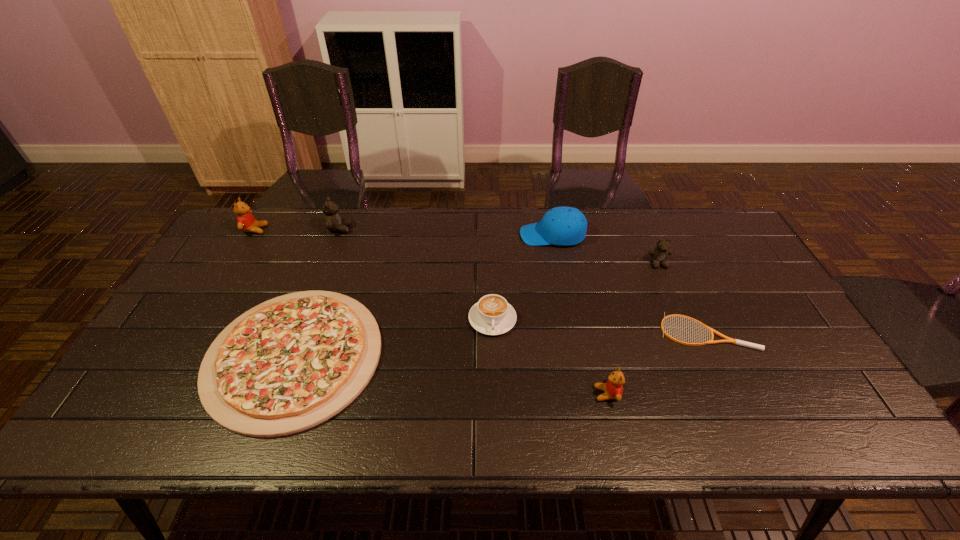
Find the location of a particular element. The image size is (960, 540). vacant space that is in between the blue cap and the tennis racket is located at coordinates (630, 284).

The height and width of the screenshot is (540, 960). Find the location of `free space between the seventh tallest object and the cap`. free space between the seventh tallest object and the cap is located at coordinates (423, 295).

Locate an element on the screen. The image size is (960, 540). free space between the fifth object from right to left and the shortest object is located at coordinates (599, 326).

Where is `free area in between the leftmost object and the second teddy bear from left to right`? This screenshot has height=540, width=960. free area in between the leftmost object and the second teddy bear from left to right is located at coordinates (298, 230).

Image resolution: width=960 pixels, height=540 pixels. I want to click on vacant space that's between the white cappuccino and the farther red teddy bear, so click(x=373, y=274).

Where is `free space that is in between the tennis racket and the bigger brown teddy bear`? free space that is in between the tennis racket and the bigger brown teddy bear is located at coordinates (523, 280).

I want to click on empty space between the smaller brown teddy bear and the farther brown teddy bear, so click(499, 246).

Locate an element on the screen. This screenshot has width=960, height=540. the closest object relative to the tennis racket is located at coordinates pos(613,389).

The width and height of the screenshot is (960, 540). In order to click on object that stands as the fourth closest to the beige tennis racket in this screenshot , I will do `click(492, 315)`.

This screenshot has height=540, width=960. In order to click on teddy bear that is the fourth closest to the fourth object from left to right in this screenshot , I will do `click(246, 222)`.